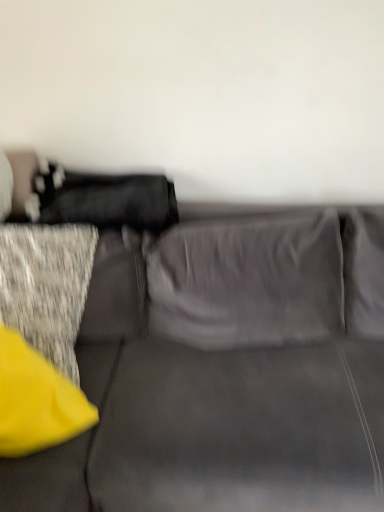
The image size is (384, 512). What do you see at coordinates (36, 400) in the screenshot? I see `yellow fabric pillow at lower left` at bounding box center [36, 400].

You are a GUI agent. You are given a task and a screenshot of the screen. Output one action in this format:
    pyautogui.click(x=<x>, y=<y>)
    Task: Click on the yellow fabric pillow at lower left
    This screenshot has height=512, width=384.
    Given the screenshot: What is the action you would take?
    pyautogui.click(x=36, y=400)

Where is `suede gray couch at center`? suede gray couch at center is located at coordinates (227, 373).

Measure the distance between point (164, 430) and camera.

A distance of 1.22 meters exists between point (164, 430) and camera.

The image size is (384, 512). Describe the element at coordinates (227, 373) in the screenshot. I see `suede gray couch at center` at that location.

Identify the location of yellow fabric pillow at lower left. (36, 400).

Considering the relative positions of yellow fabric pillow at lower left and suede gray couch at center in the image provided, is yellow fabric pillow at lower left to the right of suede gray couch at center from the viewer's perspective?

In fact, yellow fabric pillow at lower left is to the left of suede gray couch at center.

Between yellow fabric pillow at lower left and suede gray couch at center, which one is positioned behind?

yellow fabric pillow at lower left is more distant.

Is point (58, 396) behind point (357, 360)?

No, (58, 396) is closer to viewer.

From the image's perspective, is yellow fabric pillow at lower left positioned above or below suede gray couch at center?

From the image's perspective, yellow fabric pillow at lower left appears below suede gray couch at center.

From a real-world perspective, is yellow fabric pillow at lower left located higher than suede gray couch at center?

Yes, from a real-world perspective, yellow fabric pillow at lower left is over suede gray couch at center

In terms of width, does yellow fabric pillow at lower left look wider or thinner when compared to suede gray couch at center?

yellow fabric pillow at lower left is thinner than suede gray couch at center.

Considering the sizes of objects yellow fabric pillow at lower left and suede gray couch at center in the image provided, who is taller, yellow fabric pillow at lower left or suede gray couch at center?

With more height is suede gray couch at center.

Who is bigger, yellow fabric pillow at lower left or suede gray couch at center?

Bigger between the two is suede gray couch at center.

Is yellow fabric pillow at lower left surrounding suede gray couch at center?

No, suede gray couch at center is not a part of yellow fabric pillow at lower left.

Based on the photo, is there a large distance between yellow fabric pillow at lower left and suede gray couch at center?

yellow fabric pillow at lower left is actually quite close to suede gray couch at center.

Is yellow fabric pillow at lower left facing away from suede gray couch at center?

No, yellow fabric pillow at lower left is not facing the opposite direction of suede gray couch at center.

How far apart are yellow fabric pillow at lower left and suede gray couch at center?

14.77 inches.

Image resolution: width=384 pixels, height=512 pixels. In order to click on pillow behind the suede gray couch at center in this screenshot , I will do `click(36, 400)`.

Based on their positions, is suede gray couch at center located to the left or right of yellow fabric pillow at lower left?

Clearly, suede gray couch at center is on the right of yellow fabric pillow at lower left in the image.

Between suede gray couch at center and yellow fabric pillow at lower left, which one is positioned in front?

Positioned in front is suede gray couch at center.

Is point (71, 500) closer to camera compared to point (21, 379)?

Yes, it is in front of point (21, 379).

From the image's perspective, which one is positioned lower, suede gray couch at center or yellow fabric pillow at lower left?

yellow fabric pillow at lower left is shown below in the image.

From a real-world perspective, between suede gray couch at center and yellow fabric pillow at lower left, who is vertically lower?

From a 3D spatial view, suede gray couch at center is below.

Which object is wider, suede gray couch at center or yellow fabric pillow at lower left?

Wider between the two is suede gray couch at center.

Between suede gray couch at center and yellow fabric pillow at lower left, which one has more height?

With more height is suede gray couch at center.

Who is smaller, suede gray couch at center or yellow fabric pillow at lower left?

yellow fabric pillow at lower left is smaller.

Do you think suede gray couch at center is within yellow fabric pillow at lower left, or outside of it?

suede gray couch at center cannot be found inside yellow fabric pillow at lower left.

Are suede gray couch at center and yellow fabric pillow at lower left far apart?

They are positioned close to each other.

Is suede gray couch at center positioned with its back to yellow fabric pillow at lower left?

No, suede gray couch at center is not facing away from yellow fabric pillow at lower left.

You are a GUI agent. You are given a task and a screenshot of the screen. Output one action in this format:
    pyautogui.click(x=<x>, y=<y>)
    Task: Click on the studio couch above the yellow fabric pillow at lower left (from the image's perspective)
    This screenshot has width=384, height=512.
    Given the screenshot: What is the action you would take?
    pyautogui.click(x=227, y=373)

Identify the location of pillow that appears on the left of suede gray couch at center. (36, 400).

Where is `pillow behind the suede gray couch at center`? This screenshot has width=384, height=512. pillow behind the suede gray couch at center is located at coordinates pyautogui.click(x=36, y=400).